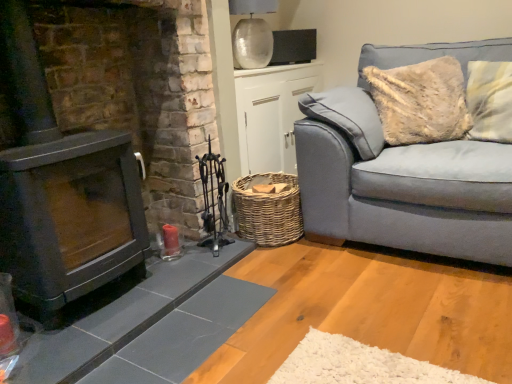
Question: Does light blue fabric couch at right have a greater height compared to woven brown basket at lower center?

Choices:
 (A) no
 (B) yes

Answer: (B)

Question: From the image's perspective, is light blue fabric couch at right located beneath woven brown basket at lower center?

Choices:
 (A) no
 (B) yes

Answer: (A)

Question: Is light blue fabric couch at right shorter than woven brown basket at lower center?

Choices:
 (A) yes
 (B) no

Answer: (B)

Question: Is light blue fabric couch at right smaller than woven brown basket at lower center?

Choices:
 (A) yes
 (B) no

Answer: (B)

Question: From a real-world perspective, is light blue fabric couch at right physically above woven brown basket at lower center?

Choices:
 (A) yes
 (B) no

Answer: (A)

Question: From the image's perspective, does light blue fabric couch at right appear higher than woven brown basket at lower center?

Choices:
 (A) yes
 (B) no

Answer: (A)

Question: Is woven wicker basket at center next to light blue fabric couch at right?

Choices:
 (A) yes
 (B) no

Answer: (B)

Question: Is light blue fabric couch at right located within woven wicker basket at center?

Choices:
 (A) yes
 (B) no

Answer: (B)

Question: Is woven wicker basket at center aimed at light blue fabric couch at right?

Choices:
 (A) no
 (B) yes

Answer: (B)

Question: Is woven wicker basket at center to the left of light blue fabric couch at right from the viewer's perspective?

Choices:
 (A) yes
 (B) no

Answer: (A)

Question: Can you confirm if woven wicker basket at center is wider than light blue fabric couch at right?

Choices:
 (A) no
 (B) yes

Answer: (A)

Question: Considering the relative positions of woven wicker basket at center and light blue fabric couch at right in the image provided, is woven wicker basket at center to the right of light blue fabric couch at right from the viewer's perspective?

Choices:
 (A) no
 (B) yes

Answer: (A)

Question: Is woven wicker basket at center at the back of light blue fabric couch at right?

Choices:
 (A) no
 (B) yes

Answer: (A)